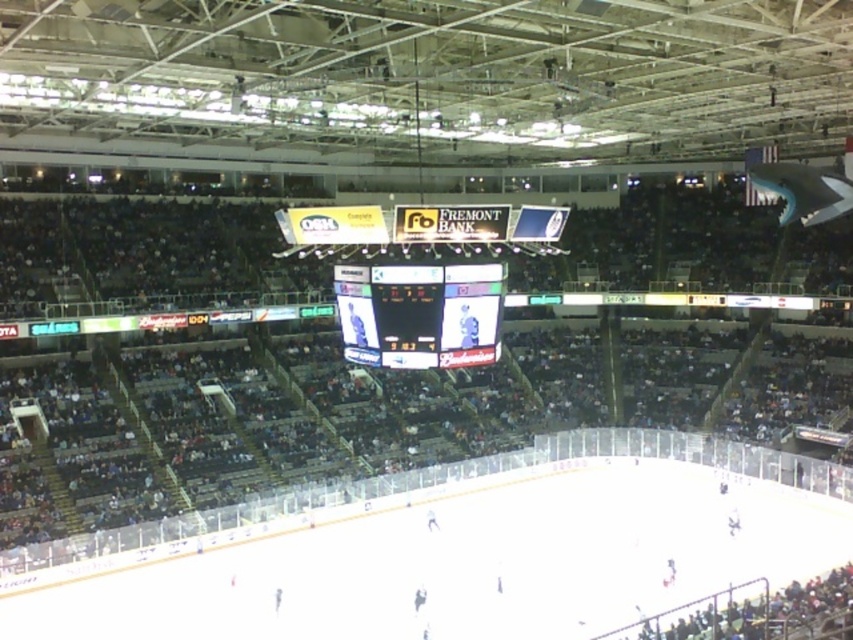
Question: Can you confirm if white smooth ice at center is positioned above black glossy scoreboard at center?

Choices:
 (A) no
 (B) yes

Answer: (A)

Question: Observing the image, what is the correct spatial positioning of white smooth ice at center in reference to black glossy scoreboard at center?

Choices:
 (A) below
 (B) above

Answer: (A)

Question: Which object appears farthest from the camera in this image?

Choices:
 (A) black glossy scoreboard at center
 (B) white smooth ice at center

Answer: (B)

Question: Observing the image, what is the correct spatial positioning of white smooth ice at center in reference to black glossy scoreboard at center?

Choices:
 (A) below
 (B) above

Answer: (A)

Question: Among these objects, which one is nearest to the camera?

Choices:
 (A) black glossy scoreboard at center
 (B) white smooth ice at center

Answer: (A)

Question: Which object appears farthest from the camera in this image?

Choices:
 (A) black glossy scoreboard at center
 (B) white smooth ice at center

Answer: (B)